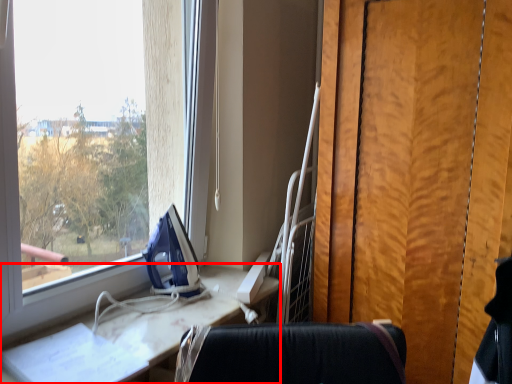
Question: Observing the image, what is the correct spatial positioning of furniture (annotated by the red box) in reference to equipment?

Choices:
 (A) right
 (B) left

Answer: (B)